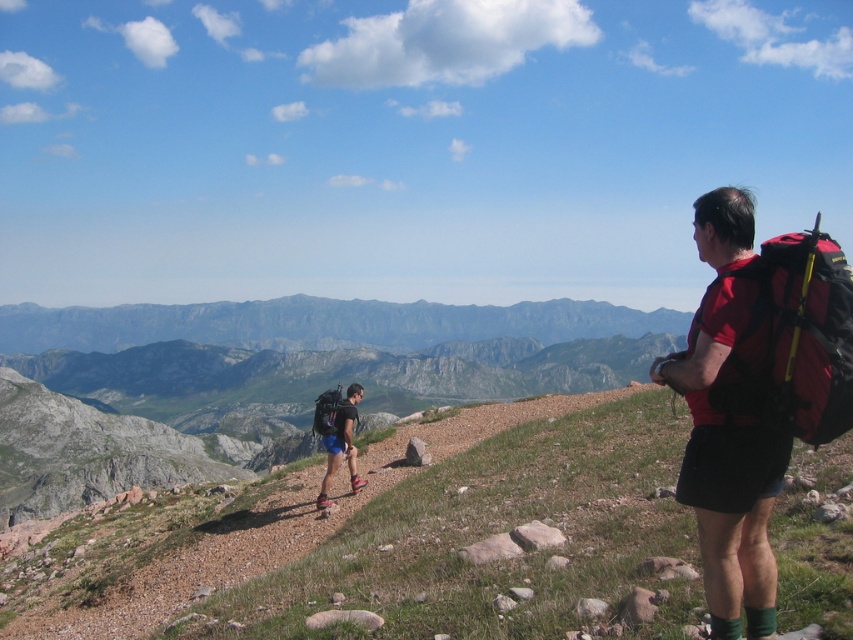
You are standing at the point marked as point (805,272) and want to reach the summit of the mountain. The path ahead is rocky and narrow. If you walk straight ahead, will you encounter the two hikers before reaching the summit?

The two hikers are 14.49 meters apart from each other, so if you walk straight ahead along the path, you will encounter them before reaching the summit.

You are a hiker standing on the path and see the red fabric backpack at right and the matte blue shorts at center. Which object is higher in elevation?

The red fabric backpack at right is higher in elevation than the matte blue shorts at center because it is positioned above it in the scene.

You are a hiker planning to carry both the red fabric backpack at right and the matte blue shorts at center. Which item can you fit into a smaller storage compartment?

The red fabric backpack at right has a smaller size compared to the matte blue shorts at center, so it can fit into a smaller storage compartment.